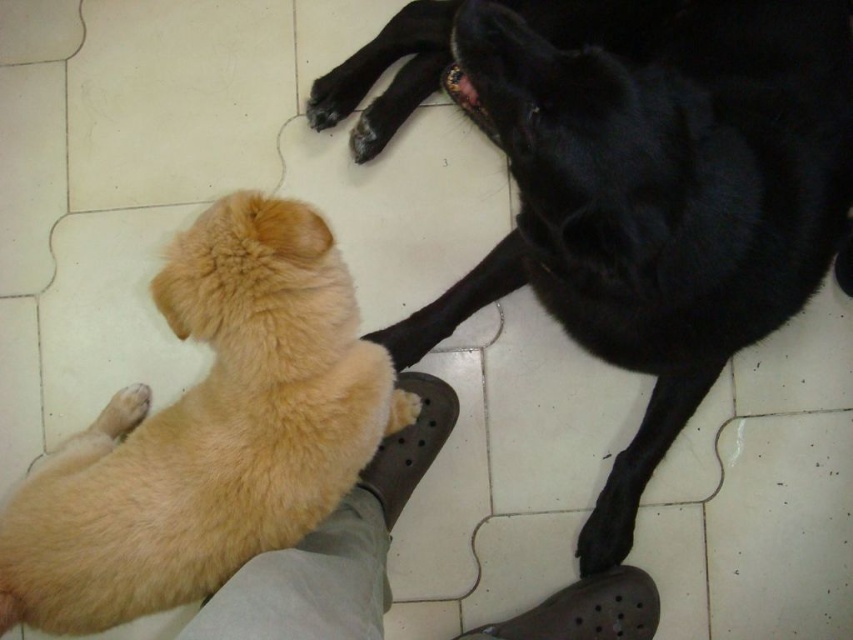
You are a photographer trying to capture a closeup shot of the point closer to the camera between point (x=181, y=532) and point (x=131, y=410). Which point should you focus on?

Point (x=181, y=532) is closer to the camera than point (x=131, y=410), so you should focus on point (x=181, y=532) for the closeup shot.

You are a dog owner who wants to place a small treat between the black matte paw at lower center and the light brown fur at lower left so both dogs can reach it. Based on their positions, where should you place the treat to ensure both can reach it easily?

The black matte paw at lower center is bigger than the light brown fur at lower left, so placing the treat closer to the light brown fur at lower left would allow both dogs to reach it easily.

You are a photographer standing at the center of the room. You want to take a photo of the shiny black dog at upper right. Where should you position your camera relative to the room?

The shiny black dog at upper right is located at coordinates 0.270 on the x axis and 0.746 on the y axis, so you should position your camera to face the upper right corner of the room to capture the dog in the frame.